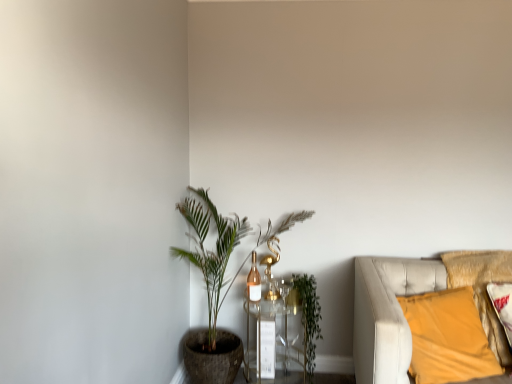
Question: From a real-world perspective, does green leafy plant at center sit lower than green leafy plant at center-left?

Choices:
 (A) yes
 (B) no

Answer: (A)

Question: Does green leafy plant at center come behind green leafy plant at center-left?

Choices:
 (A) yes
 (B) no

Answer: (A)

Question: Is green leafy plant at center thinner than green leafy plant at center-left?

Choices:
 (A) yes
 (B) no

Answer: (A)

Question: From a real-world perspective, is green leafy plant at center positioned over green leafy plant at center-left based on gravity?

Choices:
 (A) no
 (B) yes

Answer: (A)

Question: Can you confirm if green leafy plant at center is wider than green leafy plant at center-left?

Choices:
 (A) yes
 (B) no

Answer: (B)

Question: Is green leafy plant at center positioned with its back to green leafy plant at center-left?

Choices:
 (A) yes
 (B) no

Answer: (A)

Question: From the image's perspective, is green leafy plant at center on top of velvet yellow pillow at right?

Choices:
 (A) no
 (B) yes

Answer: (A)

Question: Is green leafy plant at center to the left of velvet yellow pillow at right from the viewer's perspective?

Choices:
 (A) no
 (B) yes

Answer: (B)

Question: Considering the relative positions of green leafy plant at center and velvet yellow pillow at right in the image provided, is green leafy plant at center behind velvet yellow pillow at right?

Choices:
 (A) no
 (B) yes

Answer: (B)

Question: Is green leafy plant at center aimed at velvet yellow pillow at right?

Choices:
 (A) no
 (B) yes

Answer: (A)

Question: From a real-world perspective, does green leafy plant at center sit lower than velvet yellow pillow at right?

Choices:
 (A) no
 (B) yes

Answer: (B)

Question: Considering the relative sizes of green leafy plant at center and velvet yellow pillow at right in the image provided, is green leafy plant at center wider than velvet yellow pillow at right?

Choices:
 (A) no
 (B) yes

Answer: (A)

Question: Does velvet yellow pillow at right have a lesser height compared to green leafy plant at center-left?

Choices:
 (A) no
 (B) yes

Answer: (B)